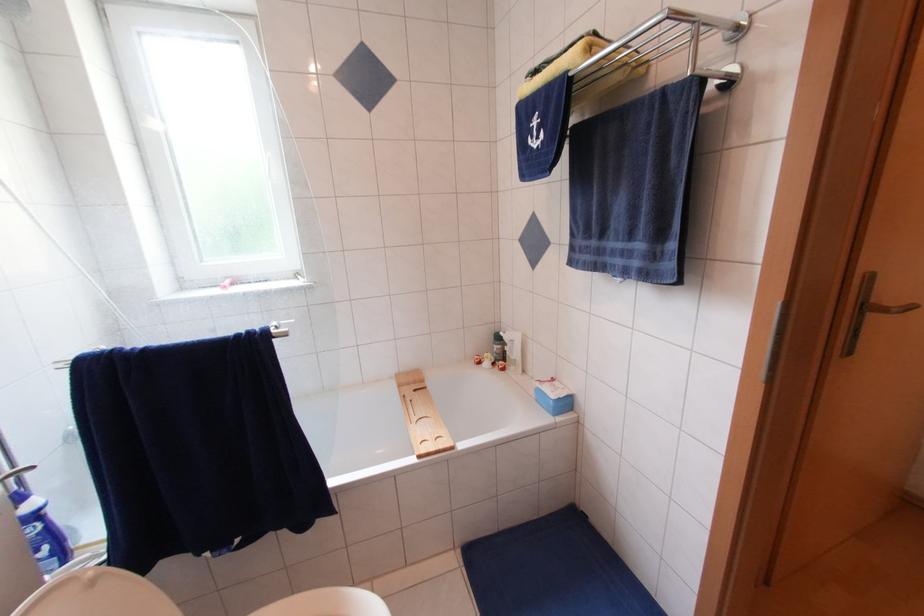
The location [421,416] corresponds to which object?

This point indicates the wooden bath caddy.